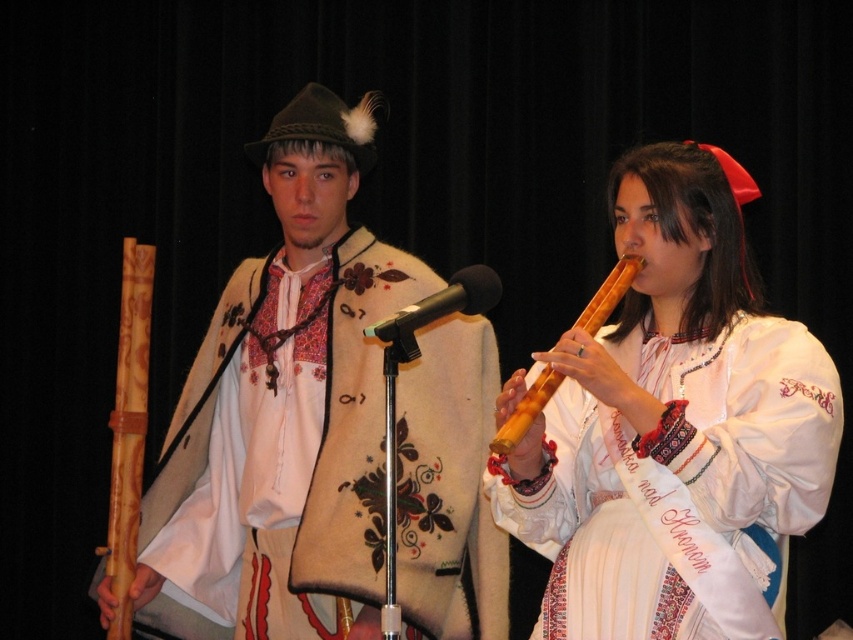
Question: Is white woolen vest at center to the right of black matte microphone at center from the viewer's perspective?

Choices:
 (A) no
 (B) yes

Answer: (A)

Question: Based on their relative distances, which object is nearer to the black matte microphone at center?

Choices:
 (A) wooden flute at center
 (B) white embroidered blouse at right

Answer: (A)

Question: Based on their relative distances, which object is nearer to the natural wood flute at left?

Choices:
 (A) wooden flute at center
 (B) white woolen vest at center
 (C) black matte microphone at center

Answer: (B)

Question: Which is nearer to the natural wood flute at left?

Choices:
 (A) black matte microphone at center
 (B) wooden flute at center

Answer: (A)

Question: Considering the relative positions of natural wood flute at left and black matte microphone at center in the image provided, where is natural wood flute at left located with respect to black matte microphone at center?

Choices:
 (A) right
 (B) left

Answer: (B)

Question: Can you confirm if natural wood flute at left is positioned below black matte microphone at center?

Choices:
 (A) yes
 (B) no

Answer: (A)